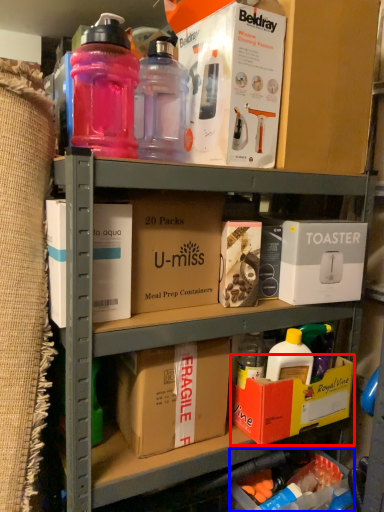
Question: Which of the following is the farthest to the observer, box (highlighted by a red box) or box (highlighted by a blue box)?

Choices:
 (A) box
 (B) box

Answer: (B)